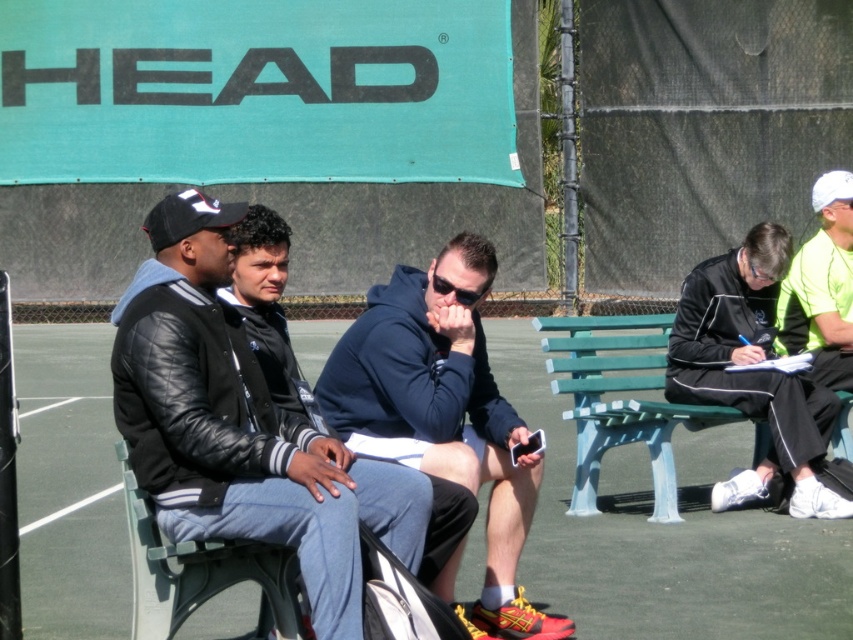
You are a photographer trying to capture a photo of both the green plastic bench at center and the green plastic bench at right. Based on their positions, which bench should you focus on first to ensure both are in the frame?

The green plastic bench at center is positioned over the green plastic bench at right, so focusing on the center bench first will ensure both are visible in the frame.

You are a person who needs to sit down. You see two green plastic benches in the scene. The green plastic bench at center and the green plastic bench at right. Which bench is closer to you?

The green plastic bench at center is closer to you because it is positioned closer to the foreground compared to the green plastic bench at right.